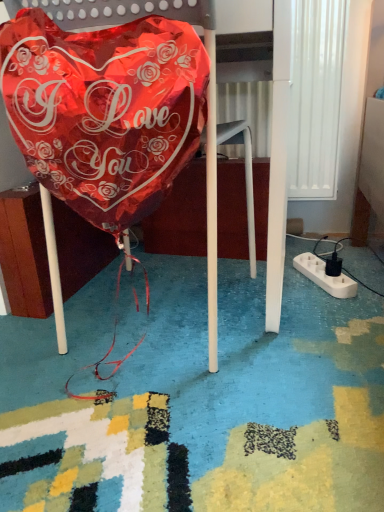
Identify the location of vacant space behind white plastic extension cord at lower right. This screenshot has width=384, height=512. (324, 252).